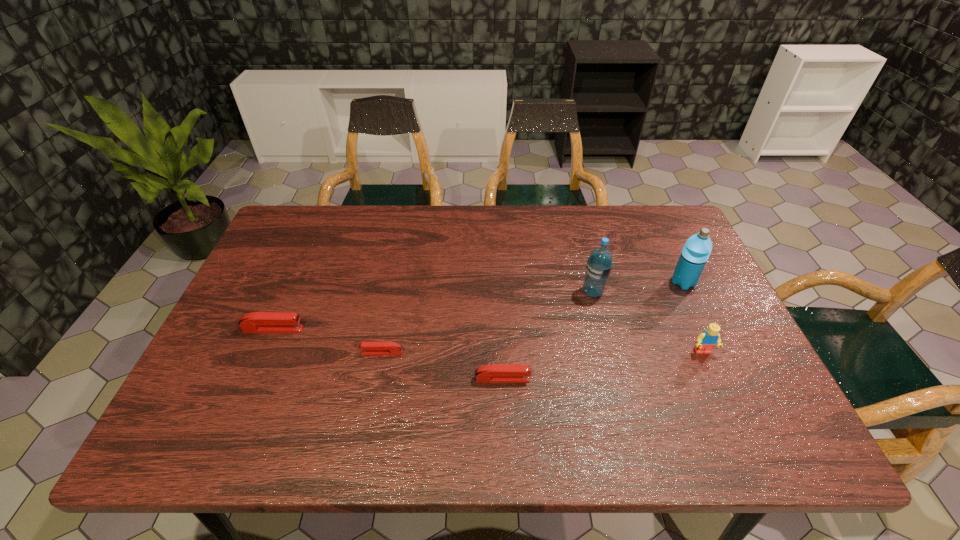
This screenshot has width=960, height=540. Find the location of `the tallest stapler`. the tallest stapler is located at coordinates (256, 322).

This screenshot has height=540, width=960. Identify the location of the leftmost object. (256, 322).

At what (x,y) coordinates should I click in order to perform the action: click on the second farthest stapler. Please return your answer as a coordinate pair (x, y). This screenshot has height=540, width=960. Looking at the image, I should click on point(375,348).

Locate an element on the screen. The width and height of the screenshot is (960, 540). the shortest object is located at coordinates (375, 348).

You are a GUI agent. You are given a task and a screenshot of the screen. Output one action in this format:
    pyautogui.click(x=<x>, y=<y>)
    Task: Click on the fifth tallest object
    This screenshot has width=960, height=540.
    Given the screenshot: What is the action you would take?
    pos(494,373)

The width and height of the screenshot is (960, 540). I want to click on the nearest stapler, so click(x=494, y=373).

Find the location of a particular element. thermos bottle is located at coordinates (696, 251).

Locate an element on the screen. the fourth shortest object is located at coordinates (708, 338).

Identify the location of the fourth object from left to right. The image size is (960, 540). (599, 264).

This screenshot has height=540, width=960. I want to click on free space located on the front-facing side of the farthest stapler, so click(x=353, y=329).